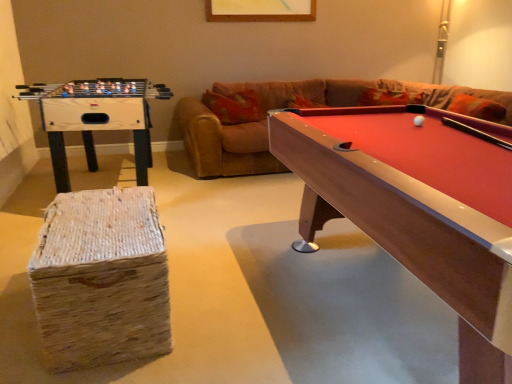
This screenshot has width=512, height=384. Find the location of `white matte ball at center-right`. white matte ball at center-right is located at coordinates (419, 120).

Locate an element on the screen. The height and width of the screenshot is (384, 512). rubberized wood billiard table at right is located at coordinates (417, 207).

Measure the distance between wooden foosball table at left and camera.

wooden foosball table at left and camera are 2.44 meters apart.

Locate an element on the screen. The width and height of the screenshot is (512, 384). white matte ball at center-right is located at coordinates (419, 120).

How different are the orientations of woven straw stool at lower left and white matte ball at center-right in degrees?

The facing directions of woven straw stool at lower left and white matte ball at center-right are 15 degrees apart.

From the image's perspective, between woven straw stool at lower left and white matte ball at center-right, which one is located above?

white matte ball at center-right appears higher in the image.

Is woven straw stool at lower left with white matte ball at center-right?

No, woven straw stool at lower left is not with white matte ball at center-right.

Can you confirm if woven straw stool at lower left is shorter than white matte ball at center-right?

Incorrect, the height of woven straw stool at lower left does not fall short of that of white matte ball at center-right.

Measure the distance between leather couch at upper right and rubberized wood billiard table at right.

leather couch at upper right and rubberized wood billiard table at right are 6.41 feet apart.

From a real-world perspective, relative to rubberized wood billiard table at right, is leather couch at upper right vertically above or below?

leather couch at upper right is situated lower than rubberized wood billiard table at right in the real world.

Which is closer to the camera, (269,155) or (328,160)?

Point (269,155) appears to be farther away from the viewer than point (328,160).

Locate an element on the screen. billiard table above the leather couch at upper right (from a real-world perspective) is located at coordinates (417, 207).

In the image, is white matte ball at center-right positioned in front of or behind rubberized wood billiard table at right?

white matte ball at center-right is behind rubberized wood billiard table at right.

Considering the points (419, 121) and (459, 266), which point is behind, point (419, 121) or point (459, 266)?

The point (419, 121) is farther.

What are the coordinates of `billiard table that is below the white matte ball at center-right (from the image's perspective)` in the screenshot? It's located at (417, 207).

Can you confirm if white matte ball at center-right is smaller than rubberized wood billiard table at right?

Yes.

Between point (87, 111) and point (185, 111), which one is positioned in front?

Point (87, 111)

Looking at this image, is wooden foosball table at left further to the viewer compared to leather couch at upper right?

No, wooden foosball table at left is closer to the viewer.

How much distance is there between wooden foosball table at left and leather couch at upper right?

wooden foosball table at left and leather couch at upper right are 4.00 feet apart.

Is wooden foosball table at left bigger than leather couch at upper right?

No, wooden foosball table at left is not bigger than leather couch at upper right.

From the image's perspective, is woven straw stool at lower left on top of leather couch at upper right?

No, from the image's perspective, woven straw stool at lower left is not over leather couch at upper right.

From a real-world perspective, between woven straw stool at lower left and leather couch at upper right, who is vertically higher?

leather couch at upper right is physically above.

Does woven straw stool at lower left turn towards leather couch at upper right?

No, woven straw stool at lower left is not facing towards leather couch at upper right.

Image resolution: width=512 pixels, height=384 pixels. What are the coordinates of `bar stool in front of the leather couch at upper right` in the screenshot? It's located at (101, 279).

Consider the image. Is white matte ball at center-right taller or shorter than woven straw stool at lower left?

white matte ball at center-right is shorter than woven straw stool at lower left.

Which is correct: white matte ball at center-right is inside woven straw stool at lower left, or outside of it?

white matte ball at center-right is outside woven straw stool at lower left.

Between white matte ball at center-right and woven straw stool at lower left, which one is positioned behind?

white matte ball at center-right is more distant.

Looking at this image, which object is positioned more to the left, white matte ball at center-right or woven straw stool at lower left?

From the viewer's perspective, woven straw stool at lower left appears more on the left side.

Is point (439, 160) more distant than point (423, 118)?

No, (439, 160) is closer to viewer.

Is rubberized wood billiard table at right located outside white matte ball at center-right?

rubberized wood billiard table at right lies outside white matte ball at center-right's area.

Is the depth of rubberized wood billiard table at right less than that of white matte ball at center-right?

Yes, rubberized wood billiard table at right is in front of white matte ball at center-right.

Find the location of a particular element. This screenshot has width=512, height=384. bar stool in front of the white matte ball at center-right is located at coordinates (101, 279).

At what (x,y) coordinates should I click in order to perform the action: click on couch that appears above the rubberized wood billiard table at right (from the image's perspective). Please return your answer as a coordinate pair (x, y). The image size is (512, 384). Looking at the image, I should click on click(x=285, y=107).

Considering their positions, is leather couch at upper right positioned further to white matte ball at center-right than rubberized wood billiard table at right?

Based on the image, leather couch at upper right appears to be further to white matte ball at center-right.

Based on their spatial positions, is rubberized wood billiard table at right or woven straw stool at lower left further from wooden foosball table at left?

rubberized wood billiard table at right is positioned further to the anchor wooden foosball table at left.

From the image, which object appears to be farther from wooden foosball table at left, rubberized wood billiard table at right or white matte ball at center-right?

Among the two, white matte ball at center-right is located further to wooden foosball table at left.

Looking at the image, which one is located closer to leather couch at upper right, woven straw stool at lower left or wooden foosball table at left?

Among the two, wooden foosball table at left is located nearer to leather couch at upper right.

From the image, which object appears to be farther from wooden foosball table at left, leather couch at upper right or rubberized wood billiard table at right?

rubberized wood billiard table at right is positioned further to the anchor wooden foosball table at left.

Looking at the image, which one is located closer to woven straw stool at lower left, wooden foosball table at left or rubberized wood billiard table at right?

wooden foosball table at left.

Estimate the real-world distances between objects in this image. Which object is closer to wooden foosball table at left, leather couch at upper right or woven straw stool at lower left?

The object closer to wooden foosball table at left is woven straw stool at lower left.

Which object lies nearer to the anchor point rubberized wood billiard table at right, white matte ball at center-right or leather couch at upper right?

The object closer to rubberized wood billiard table at right is white matte ball at center-right.

Find the location of a particular element. This screenshot has width=512, height=384. bar stool between rubberized wood billiard table at right and leather couch at upper right in the front-back direction is located at coordinates (101, 279).

The width and height of the screenshot is (512, 384). Identify the location of billiard table between woven straw stool at lower left and white matte ball at center-right in the horizontal direction. (417, 207).

The image size is (512, 384). What are the coordinates of `bar stool between wooden foosball table at left and leather couch at upper right from left to right` in the screenshot? It's located at (101, 279).

The width and height of the screenshot is (512, 384). In order to click on billiard table located between wooden foosball table at left and white matte ball at center-right in the left-right direction in this screenshot , I will do `click(417, 207)`.